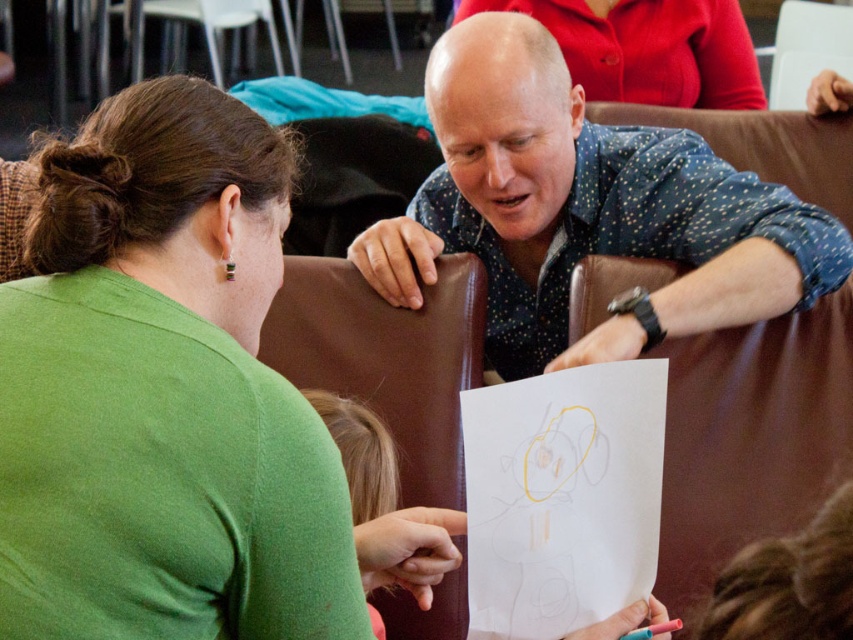
You are standing in the room and want to locate the blue dotted shirt at upper center. What are the coordinates where you can find it?

The blue dotted shirt at upper center can be found at coordinates point (585,211).

Based on the photo, what is located at the point with coordinates (585, 211)?

The point at coordinates (585, 211) is on the blue dotted shirt at upper center.